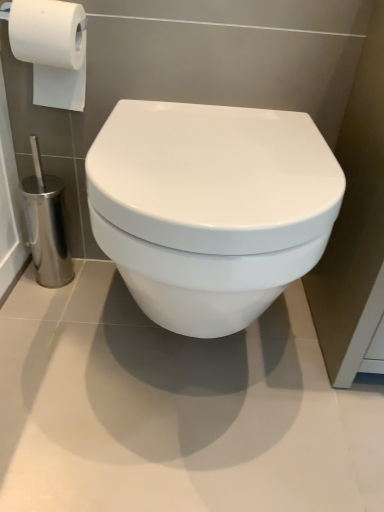
Question: Considering the relative sizes of white matte toilet paper at upper left and white glossy toilet at center in the image provided, is white matte toilet paper at upper left taller than white glossy toilet at center?

Choices:
 (A) yes
 (B) no

Answer: (B)

Question: Is white matte toilet paper at upper left at the left side of white glossy toilet at center?

Choices:
 (A) yes
 (B) no

Answer: (A)

Question: Is white matte toilet paper at upper left oriented towards white glossy toilet at center?

Choices:
 (A) yes
 (B) no

Answer: (B)

Question: Does white matte toilet paper at upper left have a larger size compared to white glossy toilet at center?

Choices:
 (A) yes
 (B) no

Answer: (B)

Question: Considering the relative sizes of white matte toilet paper at upper left and white glossy toilet at center in the image provided, is white matte toilet paper at upper left wider than white glossy toilet at center?

Choices:
 (A) yes
 (B) no

Answer: (B)

Question: Is white matte toilet paper at upper left looking in the opposite direction of white glossy toilet at center?

Choices:
 (A) no
 (B) yes

Answer: (A)

Question: From the image's perspective, does white glossy toilet at center appear higher than white matte toilet paper at upper left?

Choices:
 (A) yes
 (B) no

Answer: (B)

Question: Is white glossy toilet at center oriented towards white matte toilet paper at upper left?

Choices:
 (A) yes
 (B) no

Answer: (B)

Question: Is white glossy toilet at center in contact with white matte toilet paper at upper left?

Choices:
 (A) yes
 (B) no

Answer: (B)

Question: Can you confirm if white glossy toilet at center is taller than white matte toilet paper at upper left?

Choices:
 (A) yes
 (B) no

Answer: (A)

Question: From a real-world perspective, is white glossy toilet at center below white matte toilet paper at upper left?

Choices:
 (A) no
 (B) yes

Answer: (B)

Question: Can you confirm if white glossy toilet at center is smaller than white matte toilet paper at upper left?

Choices:
 (A) no
 (B) yes

Answer: (A)

Question: Is white matte toilet paper at upper left to the left or to the right of white glossy toilet at center in the image?

Choices:
 (A) left
 (B) right

Answer: (A)